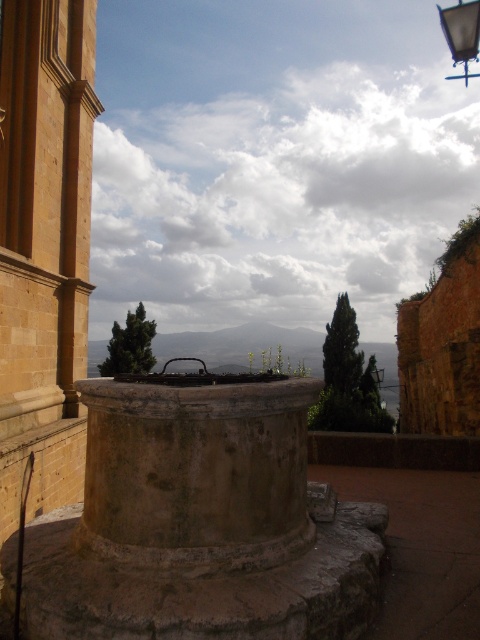
Question: Does rustic stone well at center lie in front of metallic streetlight at upper right?

Choices:
 (A) yes
 (B) no

Answer: (A)

Question: Which of the following is the closest to the observer?

Choices:
 (A) (228, 525)
 (B) (457, 10)

Answer: (A)

Question: Among these objects, which one is nearest to the camera?

Choices:
 (A) rustic stone well at center
 (B) metallic streetlight at upper right

Answer: (A)

Question: Does rustic stone well at center come behind metallic streetlight at upper right?

Choices:
 (A) no
 (B) yes

Answer: (A)

Question: Which of the following is the closest to the observer?

Choices:
 (A) (155, 493)
 (B) (478, 4)

Answer: (A)

Question: Observing the image, what is the correct spatial positioning of rustic stone well at center in reference to metallic streetlight at upper right?

Choices:
 (A) above
 (B) below

Answer: (B)